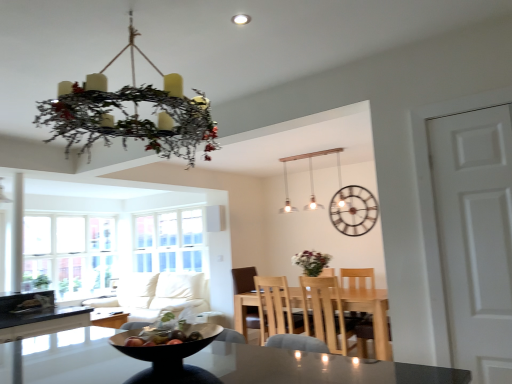
Question: Should I look upward or downward to see light wood table at center?

Choices:
 (A) up
 (B) down

Answer: (B)

Question: Is matte wooden table at center aimed at metallic clock at upper center?

Choices:
 (A) no
 (B) yes

Answer: (A)

Question: From a real-world perspective, is matte wooden table at center physically below metallic clock at upper center?

Choices:
 (A) no
 (B) yes

Answer: (B)

Question: Can you confirm if matte wooden table at center is thinner than metallic clock at upper center?

Choices:
 (A) no
 (B) yes

Answer: (A)

Question: Is matte wooden table at center further to the viewer compared to metallic clock at upper center?

Choices:
 (A) yes
 (B) no

Answer: (B)

Question: Is matte wooden table at center in front of metallic clock at upper center?

Choices:
 (A) yes
 (B) no

Answer: (A)

Question: Is matte wooden table at center wider than metallic clock at upper center?

Choices:
 (A) no
 (B) yes

Answer: (B)

Question: Does metallic clock at upper center have a greater width compared to light wood chair at center?

Choices:
 (A) yes
 (B) no

Answer: (B)

Question: Does metallic clock at upper center appear on the right side of light wood chair at center?

Choices:
 (A) no
 (B) yes

Answer: (B)

Question: Is metallic clock at upper center thinner than light wood chair at center?

Choices:
 (A) no
 (B) yes

Answer: (B)

Question: Is metallic clock at upper center turned away from light wood chair at center?

Choices:
 (A) yes
 (B) no

Answer: (B)

Question: From a real-world perspective, is metallic clock at upper center below light wood chair at center?

Choices:
 (A) yes
 (B) no

Answer: (B)

Question: Does metallic clock at upper center lie in front of light wood chair at center?

Choices:
 (A) no
 (B) yes

Answer: (A)

Question: Is matte wooden table at center thinner than shiny plastic bowl at center?

Choices:
 (A) no
 (B) yes

Answer: (A)